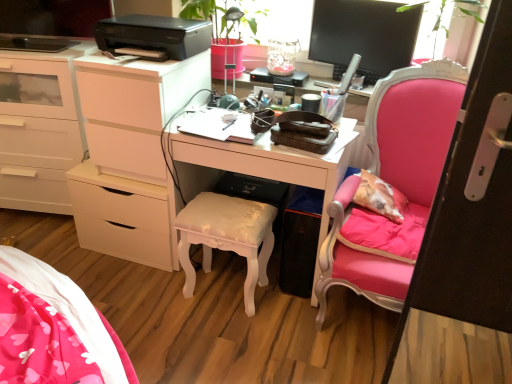
At what (x,y) coordinates should I click in order to perform the action: click on green matte plant at upper center. Please return your answer as a coordinate pair (x, y). This screenshot has width=512, height=384. Looking at the image, I should click on (205, 13).

Describe the element at coordinates (154, 35) in the screenshot. This screenshot has width=512, height=384. I see `black plastic printer at upper center` at that location.

Based on the photo, measure the distance between point (46, 199) and camera.

The distance of point (46, 199) from camera is 7.93 feet.

What do you see at coordinates (273, 159) in the screenshot?
I see `white glossy desk at center` at bounding box center [273, 159].

Describe the element at coordinates (227, 237) in the screenshot. The height and width of the screenshot is (384, 512). I see `white glossy stool at center` at that location.

Locate an element on the screen. This screenshot has width=512, height=384. green matte plant at upper center is located at coordinates (205, 13).

Considering the sizes of white glossy chest of drawers at left and green matte plant at upper center in the image, is white glossy chest of drawers at left wider or thinner than green matte plant at upper center?

white glossy chest of drawers at left is wider than green matte plant at upper center.

Is white glossy chest of drawers at left facing towards green matte plant at upper center?

No.

Which point is more forward, (153, 98) or (195, 12)?

Point (153, 98)

Is white glossy chest of drawers at left shorter than green matte plant at upper center?

No, white glossy chest of drawers at left is not shorter than green matte plant at upper center.

Who is shorter, white matte drawer at left or white glossy desk at center?

white matte drawer at left is shorter.

Can you confirm if white matte drawer at left is wider than white glossy desk at center?

Yes, white matte drawer at left is wider than white glossy desk at center.

From a real-world perspective, which object stands above the other?

white glossy desk at center is physically above.

In terms of size, does black glossy monitor at upper right appear bigger or smaller than white matte cabinet at left?

black glossy monitor at upper right is smaller than white matte cabinet at left.

From a real-world perspective, is black glossy monitor at upper right on top of white matte cabinet at left?

Indeed, from a real-world perspective, black glossy monitor at upper right stands above white matte cabinet at left.

From the image's perspective, between black glossy monitor at upper right and white matte cabinet at left, who is located below?

white matte cabinet at left appears lower in the image.

Considering the relative sizes of white matte cabinet at left and white glossy chest of drawers at left in the image provided, is white matte cabinet at left smaller than white glossy chest of drawers at left?

Actually, white matte cabinet at left might be larger than white glossy chest of drawers at left.

Is white matte cabinet at left shorter than white glossy chest of drawers at left?

A: Incorrect, the height of white matte cabinet at left does not fall short of that of white glossy chest of drawers at left.

The height and width of the screenshot is (384, 512). In order to click on the chest of drawers located above the white matte cabinet at left (from the image's perspective) in this screenshot , I will do `click(130, 155)`.

Considering the sizes of objects white matte drawer at left and white matte cabinet at left in the image provided, who is thinner, white matte drawer at left or white matte cabinet at left?

white matte cabinet at left.

Considering the relative sizes of white matte drawer at left and white matte cabinet at left in the image provided, is white matte drawer at left taller than white matte cabinet at left?

No, white matte drawer at left is not taller than white matte cabinet at left.

From the image's perspective, which is above, white matte drawer at left or white matte cabinet at left?

white matte cabinet at left appears higher in the image.

How different are the orientations of white matte drawer at left and white matte cabinet at left in degrees?

They differ by 11.3 degrees in their facing directions.

From a real-world perspective, between pink velvet chair at right and white glossy chest of drawers at left, who is vertically higher?

In real-world perspective, white glossy chest of drawers at left is above.

The width and height of the screenshot is (512, 384). In order to click on chair that is on the right side of white glossy chest of drawers at left in this screenshot , I will do `click(393, 184)`.

Is pink velvet chair at right positioned beyond the bounds of white glossy chest of drawers at left?

Yes, pink velvet chair at right is not within white glossy chest of drawers at left.

Image resolution: width=512 pixels, height=384 pixels. What are the coordinates of `television located on the left of pink velvet chair at right` in the screenshot? It's located at (362, 36).

Is black glossy monitor at upper right facing away from pink velvet chair at right?

No.

From the image's perspective, is black glossy monitor at upper right located beneath pink velvet chair at right?

Actually, black glossy monitor at upper right appears above pink velvet chair at right in the image.

Is black glossy monitor at upper right surrounding pink velvet chair at right?

No, pink velvet chair at right is not surrounded by black glossy monitor at upper right.

You are a GUI agent. You are given a task and a screenshot of the screen. Output one action in this format:
    pyautogui.click(x=<x>, y=<y>)
    Task: Click on the chest of drawers below the green matte plant at upper center (from a real-world perspective)
    Image resolution: width=512 pixels, height=384 pixels.
    Given the screenshot: What is the action you would take?
    pyautogui.click(x=130, y=155)

At what (x,y) coordinates should I click in order to perform the action: click on desk that is above the white matte drawer at left (from the image's perspective). Please return your answer as a coordinate pair (x, y). This screenshot has width=512, height=384. Looking at the image, I should click on (273, 159).

Estimate the real-world distances between objects in this image. Which object is closer to white glossy stool at center, pink velvet chair at right or white matte drawer at left?

Based on the image, white matte drawer at left appears to be nearer to white glossy stool at center.

Which object lies nearer to the anchor point pink velvet chair at right, white glossy chest of drawers at left or black glossy monitor at upper right?

black glossy monitor at upper right is closer to pink velvet chair at right.

Considering their positions, is white glossy stool at center positioned closer to white glossy desk at center than white matte drawer at left?

Based on the image, white glossy stool at center appears to be nearer to white glossy desk at center.

When comparing their distances from white glossy chest of drawers at left, does white glossy stool at center or white glossy desk at center seem closer?

Based on the image, white glossy stool at center appears to be nearer to white glossy chest of drawers at left.

When comparing their distances from black plastic printer at upper center, does white glossy desk at center or white glossy chest of drawers at left seem closer?

Based on the image, white glossy chest of drawers at left appears to be nearer to black plastic printer at upper center.

Looking at the image, which one is located further to pink velvet chair at right, black glossy monitor at upper right or white matte drawer at left?

white matte drawer at left is further to pink velvet chair at right.

When comparing their distances from white matte drawer at left, does white glossy chest of drawers at left or green matte plant at upper center seem further?

green matte plant at upper center is further to white matte drawer at left.

Looking at the image, which one is located closer to white glossy chest of drawers at left, green matte plant at upper center or pink velvet chair at right?

Based on the image, green matte plant at upper center appears to be nearer to white glossy chest of drawers at left.

The height and width of the screenshot is (384, 512). I want to click on printer between white matte cabinet at left and white glossy desk at center in the horizontal direction, so click(x=154, y=35).

I want to click on stool between white matte cabinet at left and black glossy monitor at upper right from left to right, so click(227, 237).

The image size is (512, 384). I want to click on houseplant between black plastic printer at upper center and black glossy monitor at upper right from left to right, so click(205, 13).

Identify the location of drawer between white matte cabinet at left and white glossy desk at center. (121, 216).